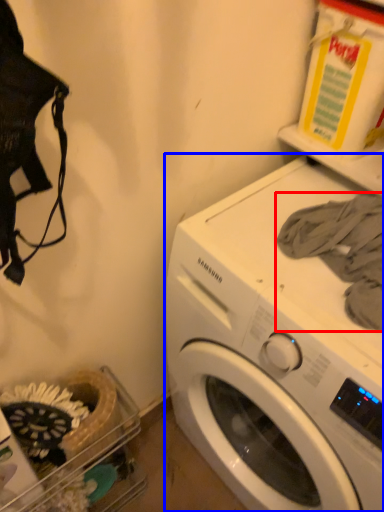
Question: Which point is further to the camera, clothing (highlighted by a red box) or washing machine (highlighted by a blue box)?

Choices:
 (A) clothing
 (B) washing machine

Answer: (A)